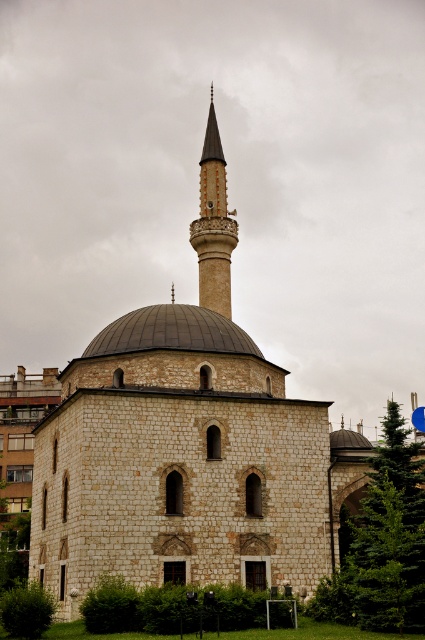
Does point (190, 340) come in front of point (201, 300)?

Yes, point (190, 340) is in front of point (201, 300).

Can you confirm if dark gray stone dome at center is taller than smooth beige minaret at upper center?

Incorrect, dark gray stone dome at center's height is not larger of smooth beige minaret at upper center's.

In the scene shown: Who is more distant from viewer, (159, 348) or (210, 284)?

The point (210, 284) is more distant.

Identify the location of dark gray stone dome at center. The image size is (425, 640). (172, 332).